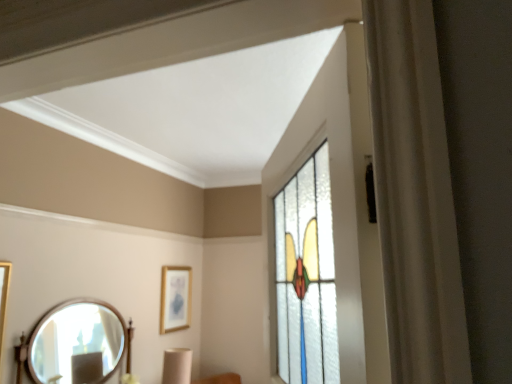
Question: Is gold-framed picture at center with wooden framed mirror at lower left?

Choices:
 (A) yes
 (B) no

Answer: (B)

Question: Does gold-framed picture at center have a greater height compared to wooden framed mirror at lower left?

Choices:
 (A) yes
 (B) no

Answer: (B)

Question: Is gold-framed picture at center to the right of wooden framed mirror at lower left from the viewer's perspective?

Choices:
 (A) no
 (B) yes

Answer: (B)

Question: From the image's perspective, is gold-framed picture at center located beneath wooden framed mirror at lower left?

Choices:
 (A) yes
 (B) no

Answer: (B)

Question: Considering the relative sizes of gold-framed picture at center and wooden framed mirror at lower left in the image provided, is gold-framed picture at center smaller than wooden framed mirror at lower left?

Choices:
 (A) no
 (B) yes

Answer: (B)

Question: Considering the relative sizes of gold-framed picture at center and wooden framed mirror at lower left in the image provided, is gold-framed picture at center shorter than wooden framed mirror at lower left?

Choices:
 (A) no
 (B) yes

Answer: (B)

Question: From the image's perspective, is wooden framed mirror at lower left over gold-framed picture at center?

Choices:
 (A) no
 (B) yes

Answer: (A)

Question: Is wooden framed mirror at lower left smaller than gold-framed picture at center?

Choices:
 (A) no
 (B) yes

Answer: (A)

Question: Can you confirm if wooden framed mirror at lower left is shorter than gold-framed picture at center?

Choices:
 (A) no
 (B) yes

Answer: (A)

Question: Can you confirm if wooden framed mirror at lower left is wider than gold-framed picture at center?

Choices:
 (A) yes
 (B) no

Answer: (A)

Question: Does wooden framed mirror at lower left have a lesser width compared to gold-framed picture at center?

Choices:
 (A) yes
 (B) no

Answer: (B)

Question: Is wooden framed mirror at lower left looking in the opposite direction of gold-framed picture at center?

Choices:
 (A) yes
 (B) no

Answer: (B)

Question: Is gold-framed picture at center wider or thinner than wooden framed mirror at lower left?

Choices:
 (A) wide
 (B) thin

Answer: (B)